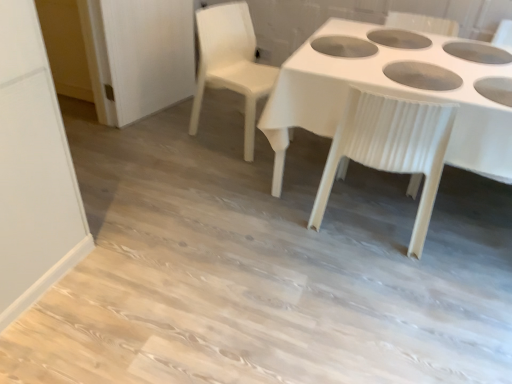
Question: Which is correct: white plastic chair at center, arranged as the 1th chair when viewed from the right, is inside white plastic table at center, or outside of it?

Choices:
 (A) outside
 (B) inside

Answer: (B)

Question: Would you say white plastic chair at center, the second chair positioned from the left, is to the left or to the right of white plastic table at center in the picture?

Choices:
 (A) right
 (B) left

Answer: (B)

Question: Which object is positioned closest to the white plastic chair at center, the second chair positioned from the left?

Choices:
 (A) white plastic table at center
 (B) white plastic chair at upper center, positioned as the second chair in right-to-left order

Answer: (A)

Question: Which of these objects is positioned closest to the white plastic table at center?

Choices:
 (A) white plastic chair at upper center, the first chair from the left
 (B) white plastic chair at center, arranged as the 1th chair when viewed from the right

Answer: (B)